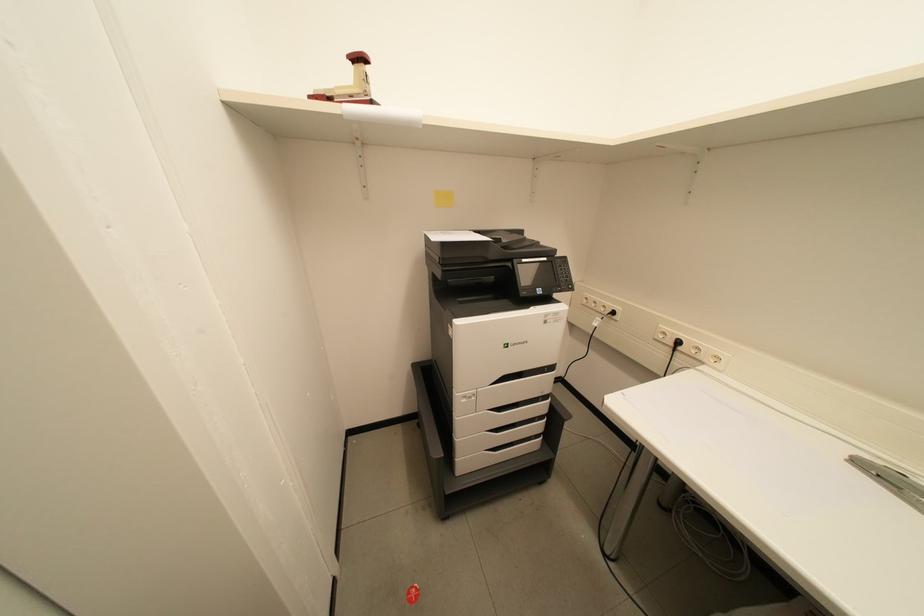
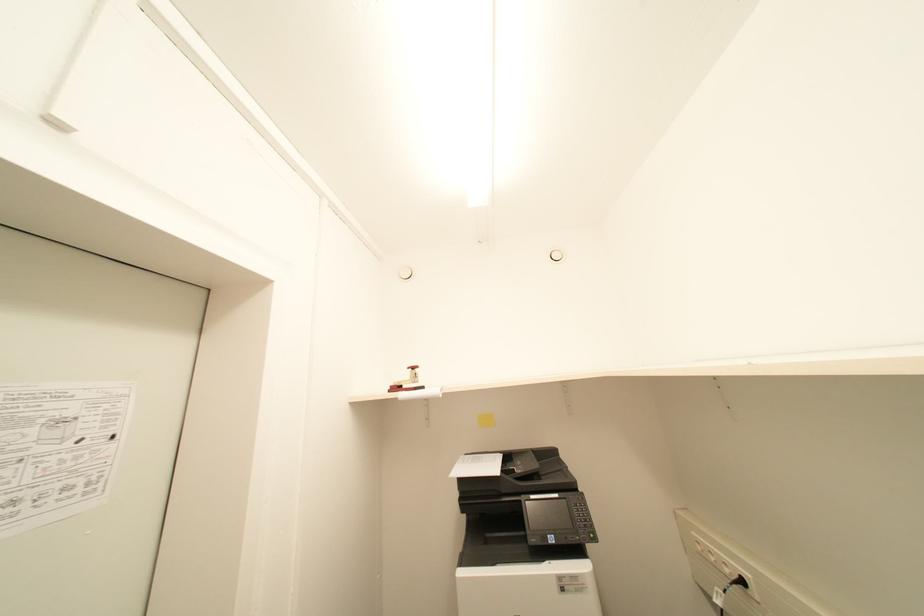
The images are taken continuously from a first-person perspective. In which direction is your viewpoint rotating?

The rotation direction of the camera is left-up.